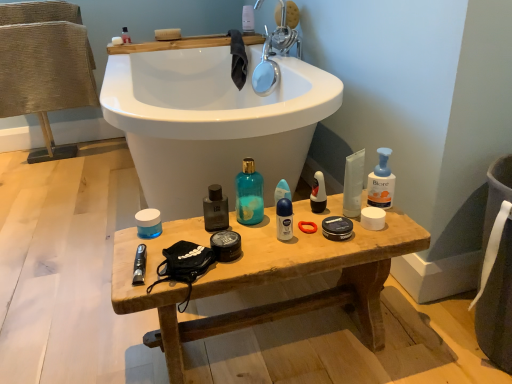
Where is `vacant space situated on the left part of matte black bottle at center, placed as the 3th toiletry when sorted from bottom to top`? The width and height of the screenshot is (512, 384). vacant space situated on the left part of matte black bottle at center, placed as the 3th toiletry when sorted from bottom to top is located at coordinates (165, 234).